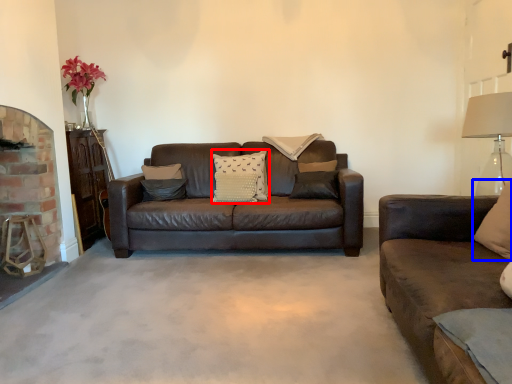
Question: Which object is further to the camera taking this photo, pillow (highlighted by a red box) or pillow (highlighted by a blue box)?

Choices:
 (A) pillow
 (B) pillow

Answer: (A)